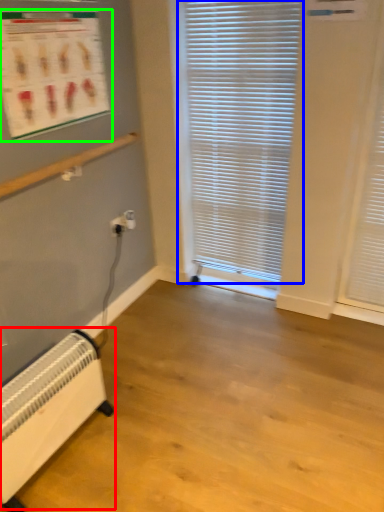
Question: Considering the real-world distances, which object is closest to heater (highlighted by a red box)? window blind (highlighted by a blue box) or bulletin board (highlighted by a green box).

Choices:
 (A) window blind
 (B) bulletin board

Answer: (B)